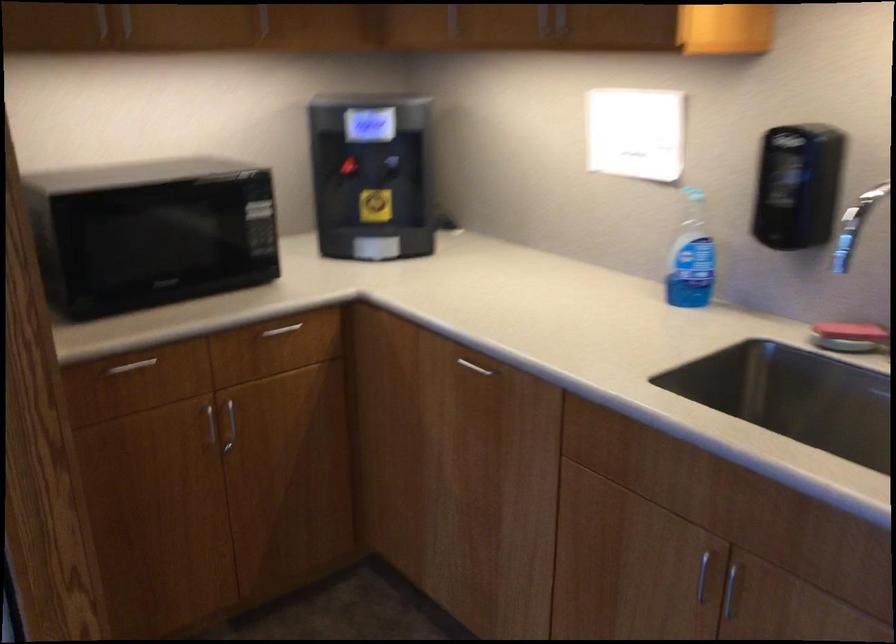
The height and width of the screenshot is (644, 896). I want to click on faucet handle, so click(x=867, y=200).